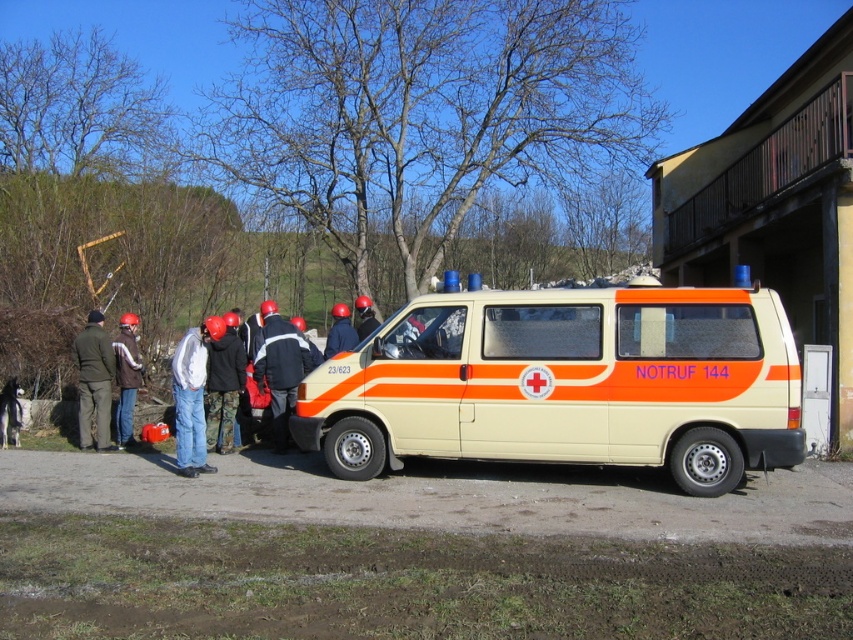
Which of these two, matte black jacket at center or dark blue uniform at center, stands taller?

dark blue uniform at center is taller.

Is point (184, 374) positioned before point (283, 449)?

Yes, it is in front of point (283, 449).

Locate an element on the screen. matte black jacket at center is located at coordinates (190, 396).

Can you confirm if dark brown leather jacket at left is taller than matte orange helmet at center?

Yes.

Does dark brown leather jacket at left appear on the right side of matte orange helmet at center?

No, dark brown leather jacket at left is not to the right of matte orange helmet at center.

Measure the distance between dark brown leather jacket at left and camera.

They are 11.15 meters apart.

Locate an element on the screen. dark brown leather jacket at left is located at coordinates (126, 378).

Is point (193, 349) positioned before point (97, 321)?

Yes, it is.

Is matte black jacket at center above khaki fabric jacket at left?

Incorrect, matte black jacket at center is not positioned above khaki fabric jacket at left.

You are a GUI agent. You are given a task and a screenshot of the screen. Output one action in this format:
    pyautogui.click(x=<x>, y=<y>)
    Task: Click on the matte black jacket at center
    This screenshot has height=640, width=853.
    Given the screenshot: What is the action you would take?
    pyautogui.click(x=190, y=396)

Find the location of a particular element. matte black jacket at center is located at coordinates (190, 396).